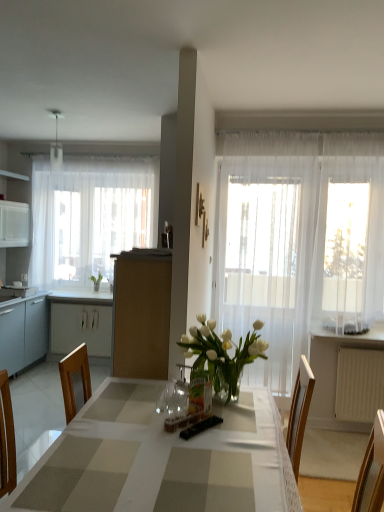
Question: Do you think transparent fabric window at right is within green leafy plant at left, or outside of it?

Choices:
 (A) inside
 (B) outside

Answer: (B)

Question: Is transparent fabric window at right wider or thinner than green leafy plant at left?

Choices:
 (A) wide
 (B) thin

Answer: (A)

Question: Estimate the real-world distances between objects in this image. Which object is closer to the white matte cabinet at left, acting as the first cabinetry starting from the back?

Choices:
 (A) white sheer curtain at left, which ranks as the first curtain in back-to-front order
 (B) translucent glass vase at center
 (C) white glossy counter top at lower left
 (D) transparent fabric window at right
 (E) white plastic radiator at lower right

Answer: (C)

Question: Which of these objects is positioned closest to the transparent fabric window at right?

Choices:
 (A) white sheer curtain at left, the 2th curtain in the right-to-left sequence
 (B) matte blue cabinet at left, which ranks as the 2th cabinetry in back-to-front order
 (C) translucent glass vase at center
 (D) green leafy plant at left
 (E) checkered fabric table at center

Answer: (C)